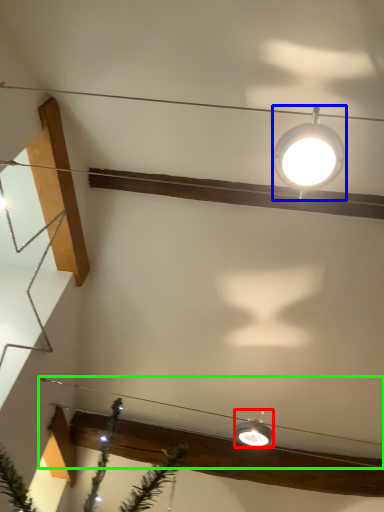
Question: Which object is the farthest from lamp (highlighted by a red box)? Choose among these: lamp (highlighted by a blue box) or wire (highlighted by a green box).

Choices:
 (A) lamp
 (B) wire

Answer: (A)